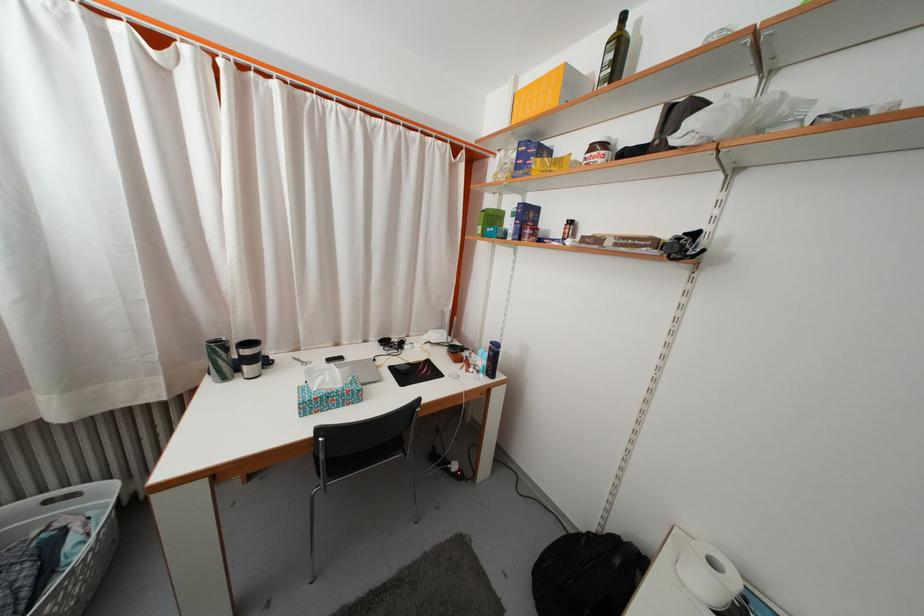
Which object does [528,156] point to?

This point indicates the blue cardboard box.